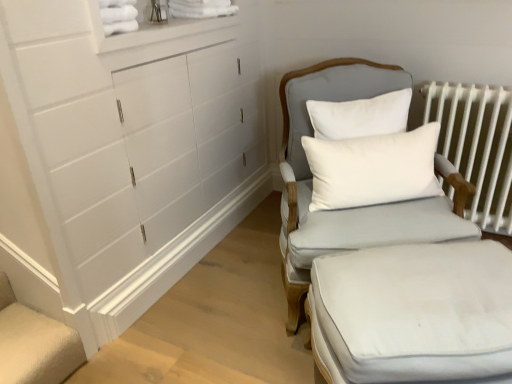
The height and width of the screenshot is (384, 512). What are the coordinates of `white metal radiator at right` in the screenshot? It's located at (477, 145).

I want to click on white fabric ottoman at lower right, so click(x=414, y=313).

Considering the positions of objects white cotton pillow at center and white fabric ottoman at lower right in the image provided, who is more to the right, white cotton pillow at center or white fabric ottoman at lower right?

white fabric ottoman at lower right.

Considering the positions of points (303, 140) and (414, 257), is point (303, 140) closer to camera compared to point (414, 257)?

No, it is not.

Locate an element on the screen. Image resolution: width=512 pixels, height=384 pixels. pillow that is above the white fabric ottoman at lower right (from a real-world perspective) is located at coordinates (373, 168).

Is white cotton pillow at center shorter than white fabric ottoman at lower right?

Indeed, white cotton pillow at center has a lesser height compared to white fabric ottoman at lower right.

Consider the image. Is white cotton pillow at center wider or thinner than white metal radiator at right?

Considering their sizes, white cotton pillow at center looks slimmer than white metal radiator at right.

Which is closer to the camera, [398,174] or [488,104]?

The point [398,174] is more forward.

In the scene shown: From the image's perspective, is white cotton pillow at center positioned above or below white metal radiator at right?

From the image's perspective, white cotton pillow at center appears below white metal radiator at right.

From a real-world perspective, is white fabric ottoman at lower right physically located above or below white metal radiator at right?

white fabric ottoman at lower right is situated lower than white metal radiator at right in the real world.

Is white fabric ottoman at lower right next to white metal radiator at right?

No.

Between white fabric ottoman at lower right and white metal radiator at right, which one has smaller width?

With smaller width is white metal radiator at right.

From their relative heights in the image, would you say white fabric ottoman at lower right is taller or shorter than white metal radiator at right?

white fabric ottoman at lower right is shorter than white metal radiator at right.

Is white fabric ottoman at lower right positioned with its back to light gray fabric chair at center-right?

That's right, white fabric ottoman at lower right is facing away from light gray fabric chair at center-right.

The height and width of the screenshot is (384, 512). What are the coordinates of `chair that is above the white fabric ottoman at lower right (from a real-world perspective)` in the screenshot? It's located at (349, 209).

Is light gray fabric chair at center-right inside white fabric ottoman at lower right?

No, light gray fabric chair at center-right is located outside of white fabric ottoman at lower right.

From the image's perspective, who appears lower, white cotton pillow at center or light gray fabric chair at center-right?

light gray fabric chair at center-right, from the image's perspective.

Based on the photo, is the position of white cotton pillow at center less distant than that of light gray fabric chair at center-right?

No, white cotton pillow at center is behind light gray fabric chair at center-right.

Consider the image. Considering the relative sizes of white cotton pillow at center and light gray fabric chair at center-right in the image provided, is white cotton pillow at center taller than light gray fabric chair at center-right?

Incorrect, the height of white cotton pillow at center is not larger of that of light gray fabric chair at center-right.

Which is behind, point (437, 224) or point (452, 352)?

The point (437, 224) is farther.

Is the position of light gray fabric chair at center-right more distant than that of white fabric ottoman at lower right?

Yes, the depth of light gray fabric chair at center-right is greater than that of white fabric ottoman at lower right.

Is light gray fabric chair at center-right taller or shorter than white fabric ottoman at lower right?

light gray fabric chair at center-right is taller than white fabric ottoman at lower right.

Does white metal radiator at right have a greater width compared to white fabric ottoman at lower right?

Incorrect, the width of white metal radiator at right does not surpass that of white fabric ottoman at lower right.

From a real-world perspective, which object stands above the other?

white metal radiator at right is physically above.

Is white metal radiator at right facing towards white fabric ottoman at lower right?

Yes, white metal radiator at right is turned towards white fabric ottoman at lower right.

Between white metal radiator at right and white fabric ottoman at lower right, which one has larger size?

white fabric ottoman at lower right is bigger.

Where is `changing table that appears below the white cotton pillow at center (from a real-world perspective)`? This screenshot has width=512, height=384. changing table that appears below the white cotton pillow at center (from a real-world perspective) is located at coordinates (414, 313).

Where is `pillow to the left of white metal radiator at right`? Image resolution: width=512 pixels, height=384 pixels. pillow to the left of white metal radiator at right is located at coordinates (373, 168).

Looking at the image, which one is located further to white metal radiator at right, white cotton pillow at center or white fabric ottoman at lower right?

white fabric ottoman at lower right lies further to white metal radiator at right than the other object.

Considering their positions, is white fabric ottoman at lower right positioned closer to white metal radiator at right than light gray fabric chair at center-right?

Based on the image, light gray fabric chair at center-right appears to be nearer to white metal radiator at right.

Which object lies nearer to the anchor point light gray fabric chair at center-right, white cotton pillow at center or white metal radiator at right?

The object closer to light gray fabric chair at center-right is white cotton pillow at center.

From the picture: Based on their spatial positions, is light gray fabric chair at center-right or white cotton pillow at center closer to white metal radiator at right?

The object closer to white metal radiator at right is light gray fabric chair at center-right.

Looking at the image, which one is located further to white metal radiator at right, white cotton pillow at center or light gray fabric chair at center-right?

white cotton pillow at center is further to white metal radiator at right.

Based on the photo, based on their spatial positions, is white cotton pillow at center or light gray fabric chair at center-right further from white fabric ottoman at lower right?

white cotton pillow at center lies further to white fabric ottoman at lower right than the other object.

Estimate the real-world distances between objects in this image. Which object is further from white cotton pillow at center, white fabric ottoman at lower right or white metal radiator at right?

Among the two, white metal radiator at right is located further to white cotton pillow at center.

Based on their spatial positions, is white metal radiator at right or light gray fabric chair at center-right closer to white fabric ottoman at lower right?

light gray fabric chair at center-right lies closer to white fabric ottoman at lower right than the other object.

Identify the location of pillow located between white fabric ottoman at lower right and white metal radiator at right in the depth direction. (373, 168).

You are a GUI agent. You are given a task and a screenshot of the screen. Output one action in this format:
    pyautogui.click(x=<x>, y=<y>)
    Task: Click on the chair between white fabric ottoman at lower right and white metal radiator at right along the z-axis
    
    Given the screenshot: What is the action you would take?
    pyautogui.click(x=349, y=209)

This screenshot has width=512, height=384. In order to click on chair between white cotton pillow at center and white fabric ottoman at lower right in the vertical direction in this screenshot , I will do `click(349, 209)`.

This screenshot has width=512, height=384. Identify the location of pillow situated between light gray fabric chair at center-right and white metal radiator at right from left to right. (373, 168).